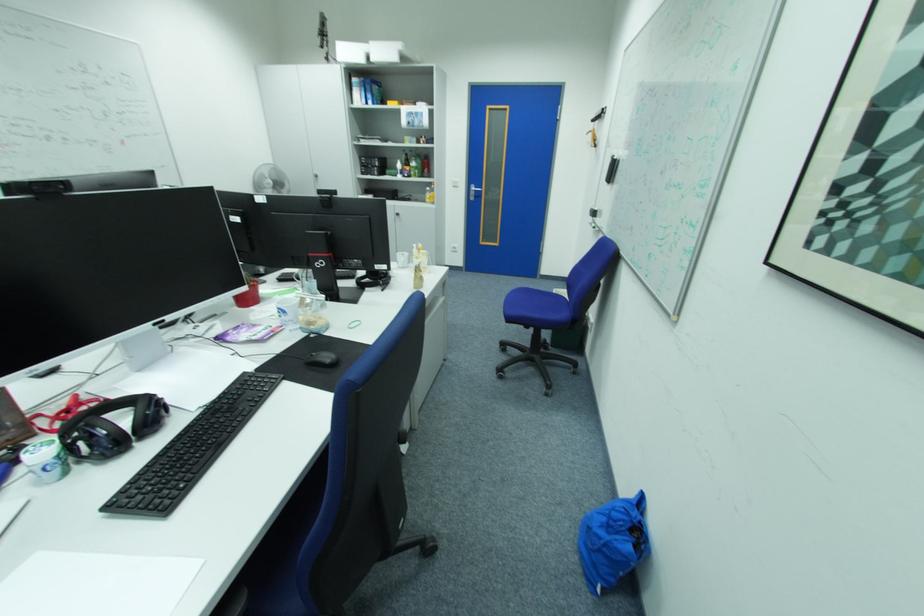
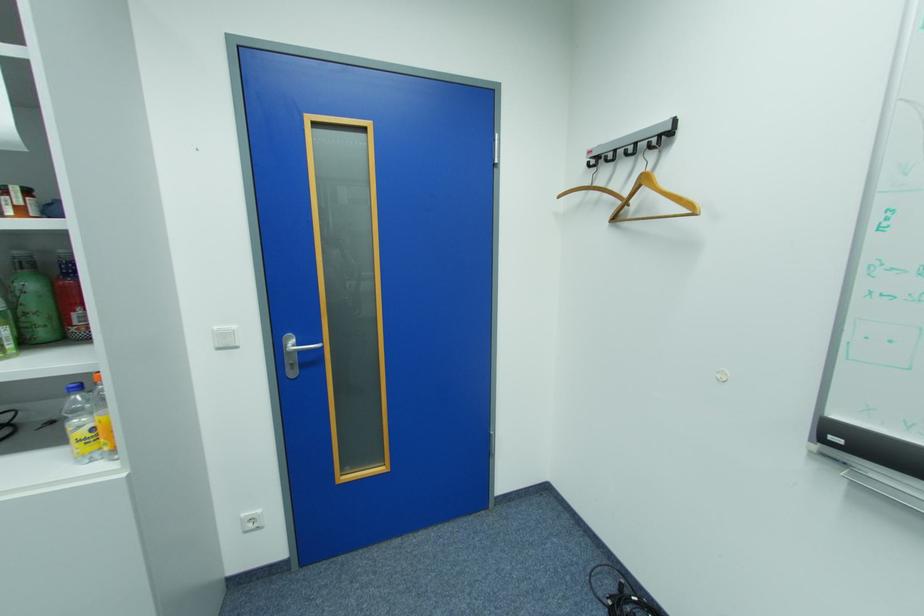
The point at (434, 154) is marked in the first image. Where is the corresponding point in the second image?

(69, 252)